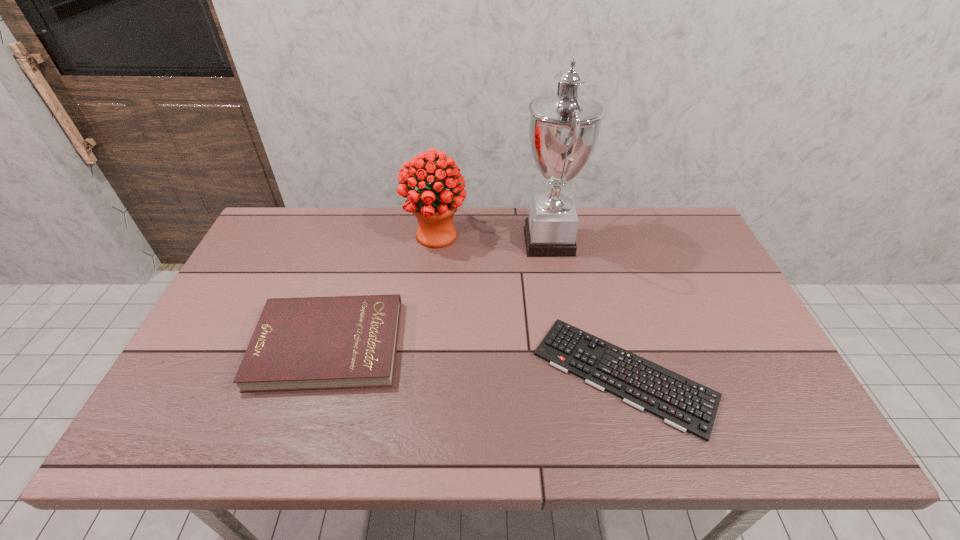
Locate an element on the screen. vacant space at the far left corner of the desktop is located at coordinates (274, 247).

Locate an element on the screen. This screenshot has height=540, width=960. vacant space in between the shortest object and the bouquet is located at coordinates (530, 305).

Image resolution: width=960 pixels, height=540 pixels. Identify the location of free space between the trophy cup and the bouquet. (492, 238).

You are a GUI agent. You are given a task and a screenshot of the screen. Output one action in this format:
    pyautogui.click(x=<x>, y=<y>)
    Task: Click on the vacant point located between the hardback book and the bouquet
    This screenshot has width=960, height=540.
    Given the screenshot: What is the action you would take?
    pyautogui.click(x=382, y=289)

Identify the location of vacant area that lies between the second shortest object and the third shortest object. The width and height of the screenshot is (960, 540). (382, 289).

Identify the location of free space between the shortest object and the trophy cup. The height and width of the screenshot is (540, 960). (587, 308).

You are a GUI agent. You are given a task and a screenshot of the screen. Output one action in this format:
    pyautogui.click(x=<x>, y=<y>)
    Task: Click on the free space that is in between the computer keyboard and the bouquet
    
    Given the screenshot: What is the action you would take?
    pyautogui.click(x=530, y=305)

You are a GUI agent. You are given a task and a screenshot of the screen. Output one action in this format:
    pyautogui.click(x=<x>, y=<y>)
    Task: Click on the vacant region between the tallest object and the hardback book
    This screenshot has width=960, height=540.
    Given the screenshot: What is the action you would take?
    pyautogui.click(x=439, y=293)

The width and height of the screenshot is (960, 540). Identify the location of free point between the third tallest object and the computer keyboard. (x=476, y=360).

Image resolution: width=960 pixels, height=540 pixels. What are the coordinates of `empty location between the shortest object and the hardback book` in the screenshot? It's located at pyautogui.click(x=476, y=360).